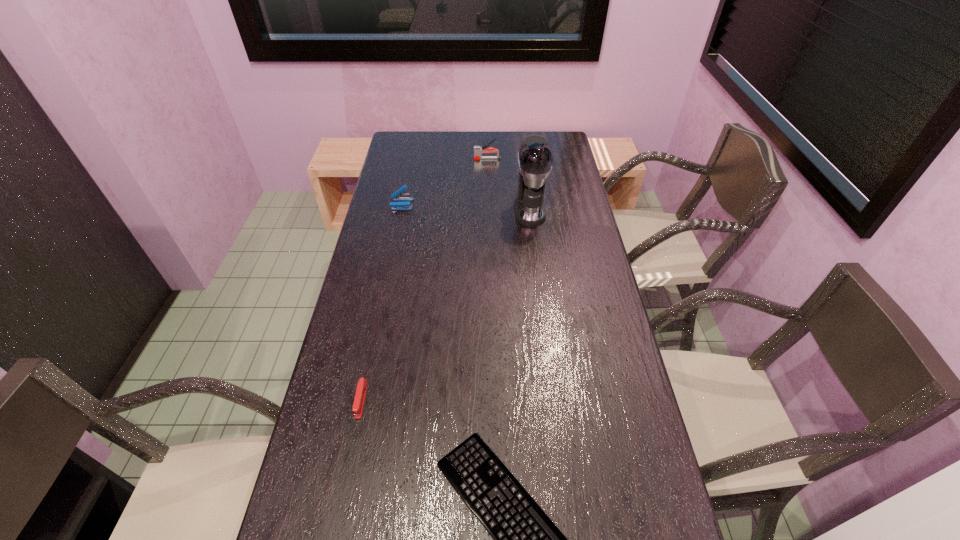
The image size is (960, 540). I want to click on the tallest object, so click(535, 158).

In order to click on the farthest object in this screenshot , I will do `click(478, 150)`.

Locate an element on the screen. This screenshot has width=960, height=540. the rightmost stapler is located at coordinates (478, 150).

Find the location of `the third shortest object`. the third shortest object is located at coordinates (396, 196).

Identify the location of the second farthest stapler. (396, 196).

Find the location of `the nearest stapler`. the nearest stapler is located at coordinates (361, 390).

Where is `the shortest stapler`? The height and width of the screenshot is (540, 960). the shortest stapler is located at coordinates coord(361,390).

The height and width of the screenshot is (540, 960). In order to click on vacant space positioned 0.120m place cup under the spout of the tallest object in this screenshot , I will do `click(535, 249)`.

Find the location of a particular element. The image size is (960, 540). vacant area situated on the handle side of the farthest object is located at coordinates coord(442,159).

The width and height of the screenshot is (960, 540). I want to click on free space located 0.180m on the handle side of the farthest object, so click(x=432, y=159).